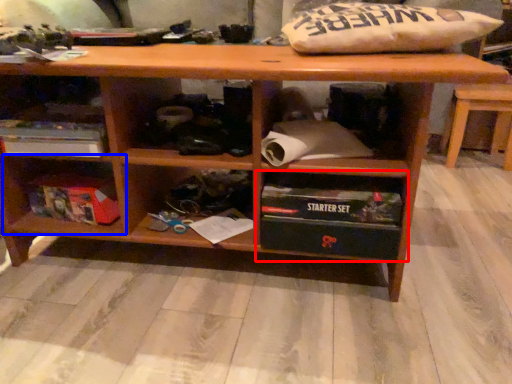
Question: Among these objects, which one is nearest to the camera, shelf (highlighted by a red box) or shelf (highlighted by a blue box)?

Choices:
 (A) shelf
 (B) shelf

Answer: (A)